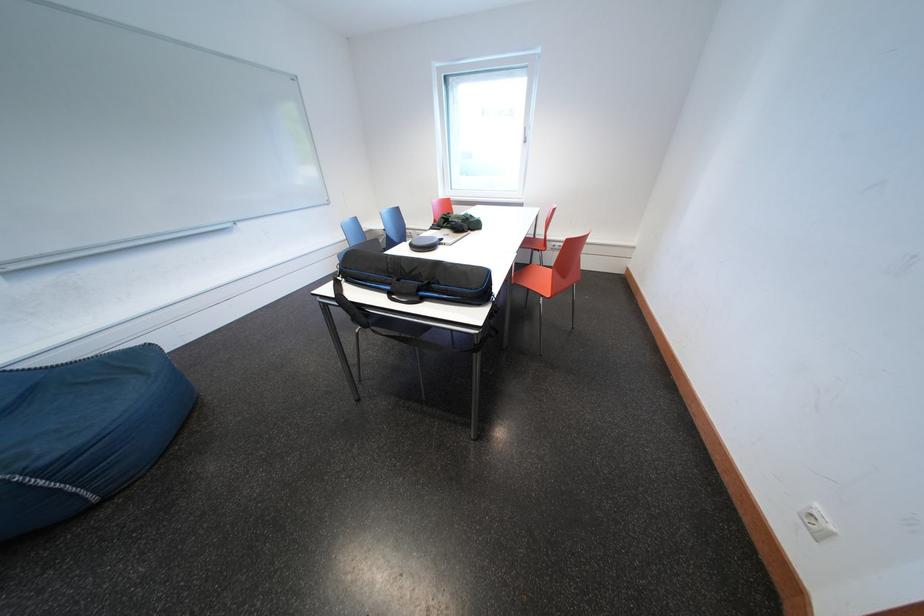
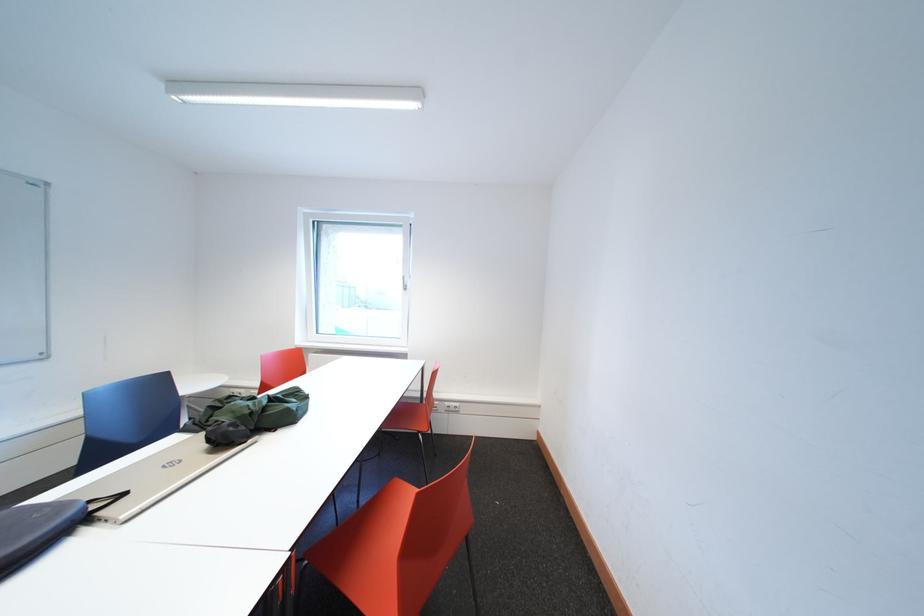
Where in the second image is the point corresponding to point 452,244 from the first image?

(134, 499)